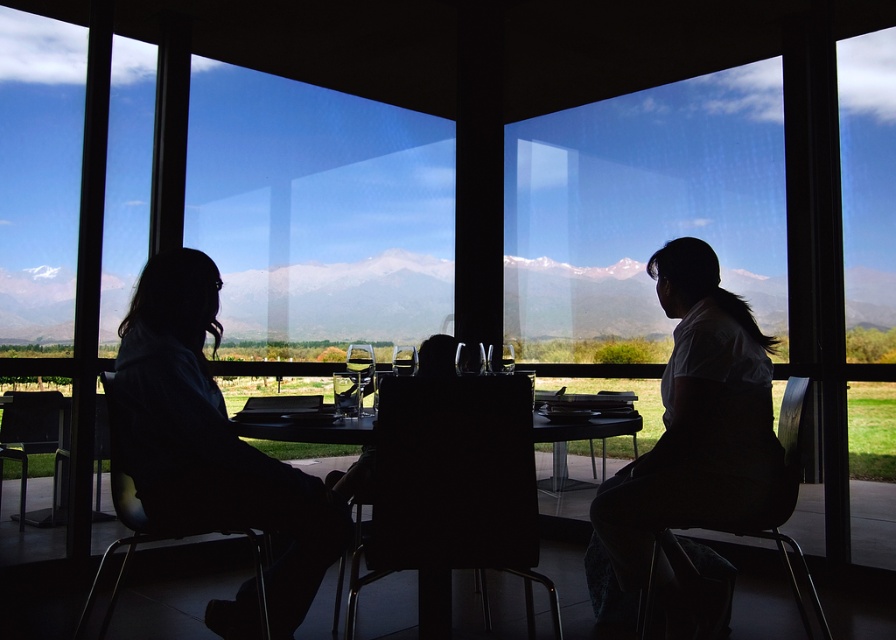
You are standing in the modern glass room and need to place a small vase exactly where the silhouette jacket at center is located. Can you confirm the coordinates for placing the vase?

The coordinates for placing the vase should be at point (211, 440) where the silhouette jacket at center is located.